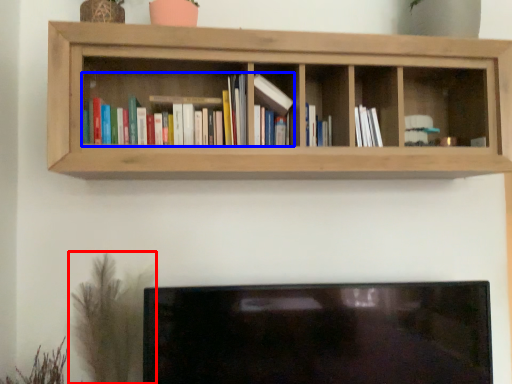
Question: Which object is closer to the camera taking this photo, plant (highlighted by a red box) or book (highlighted by a blue box)?

Choices:
 (A) plant
 (B) book

Answer: (B)